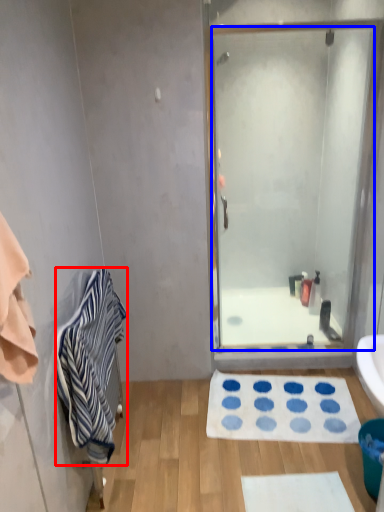
Question: Which object is closer to the camera taking this photo, towel/napkin (highlighted by a red box) or door (highlighted by a blue box)?

Choices:
 (A) towel/napkin
 (B) door

Answer: (A)